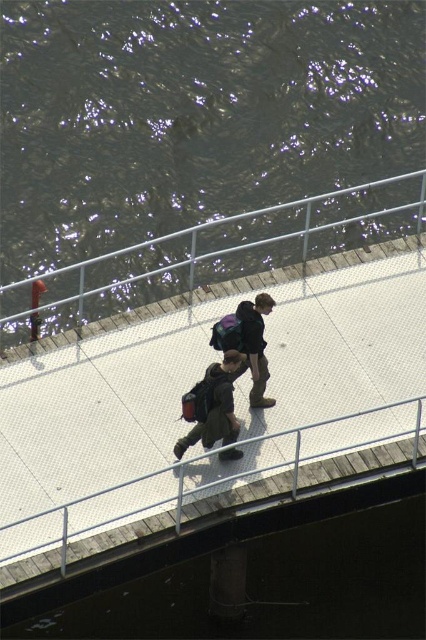
You are a photographer trying to capture a clear shot of the transparent water at bridge center and the white textured rail at center. Since the rail is partially blocking your view of the water, can you adjust your position to see both objects clearly without the rail overlapping the water?

The white textured rail at center is behind transparent water at bridge center, so you can adjust your position to see both objects clearly without the rail overlapping the water by moving to a viewpoint where the rail is visible through the transparent water.